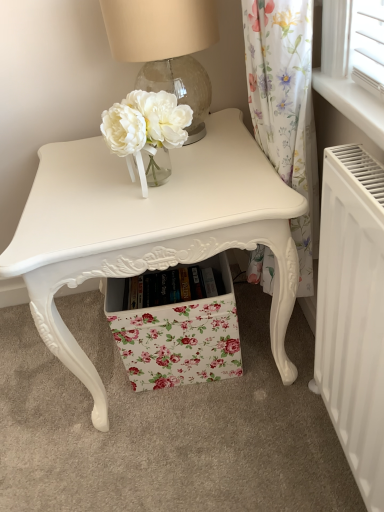
Where is `empty space that is ontop of matte white table at center (from a real-world perspective)`? The width and height of the screenshot is (384, 512). empty space that is ontop of matte white table at center (from a real-world perspective) is located at coordinates (174, 162).